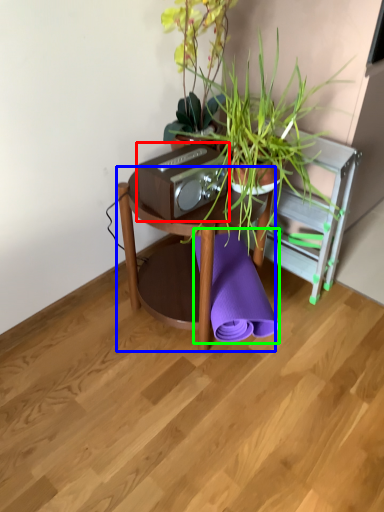
Question: Which object is positioned closest to stereo (highlighted by a red box)? Select from table (highlighted by a blue box) and beach towel (highlighted by a green box).

Choices:
 (A) table
 (B) beach towel

Answer: (A)